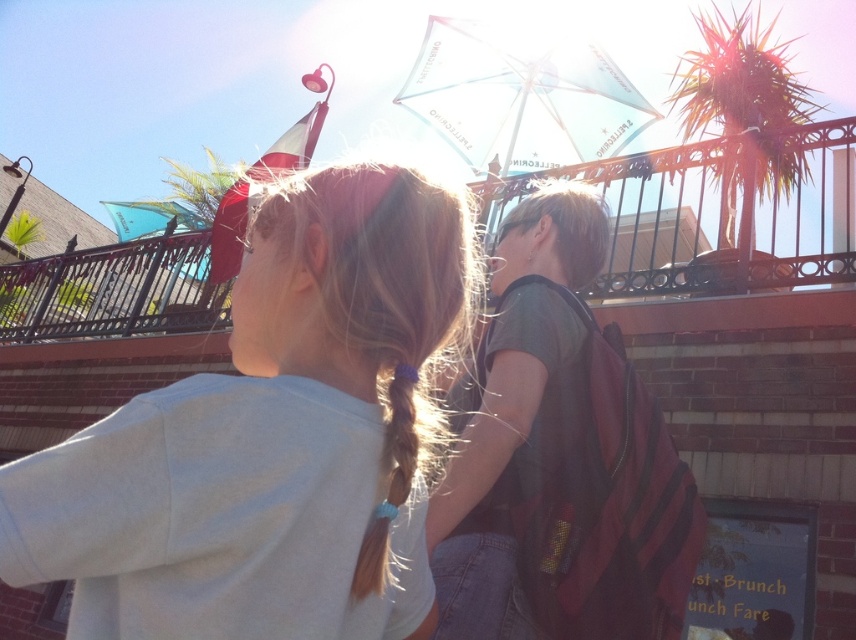
Question: Based on their relative distances, which object is farther from the brown silky hair at center?

Choices:
 (A) dark gray backpack at center
 (B) light gray t-shirt at upper center

Answer: (A)

Question: Does light gray t-shirt at upper center appear on the left side of brown silky hair at center?

Choices:
 (A) no
 (B) yes

Answer: (B)

Question: Is dark gray backpack at center to the right of brown silky hair at center from the viewer's perspective?

Choices:
 (A) no
 (B) yes

Answer: (B)

Question: Which of the following is the closest to the observer?

Choices:
 (A) (372, 576)
 (B) (336, 170)
 (C) (476, 474)

Answer: (A)

Question: Which point is closer to the camera taking this photo?

Choices:
 (A) (631, 572)
 (B) (369, 525)

Answer: (B)

Question: Is light gray t-shirt at upper center in front of brown silky hair at center?

Choices:
 (A) yes
 (B) no

Answer: (A)